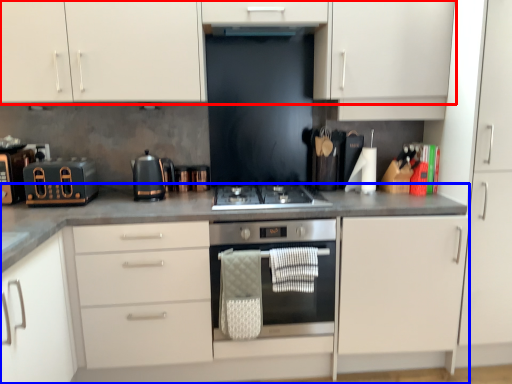
Question: Which object is closer to the camera taking this photo, cabinetry (highlighted by a red box) or countertop (highlighted by a blue box)?

Choices:
 (A) cabinetry
 (B) countertop

Answer: (B)